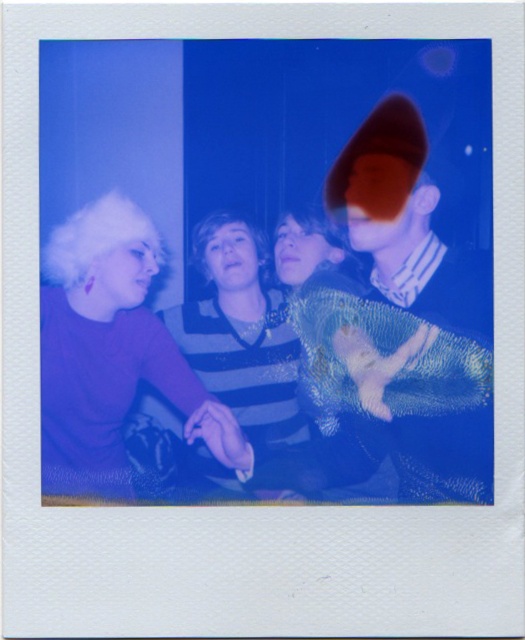
Question: Among these objects, which one is nearest to the camera?

Choices:
 (A) shiny metallic jacket at right
 (B) purple matte shirt at left

Answer: (B)

Question: Is shiny metallic jacket at right smaller than purple shiny sweater at center?

Choices:
 (A) yes
 (B) no

Answer: (B)

Question: Does shiny metallic jacket at right appear on the left side of purple matte shirt at left?

Choices:
 (A) yes
 (B) no

Answer: (B)

Question: Among these objects, which one is farthest from the camera?

Choices:
 (A) shiny metallic jacket at right
 (B) purple shiny sweater at center

Answer: (B)

Question: Is shiny metallic jacket at right to the left of purple matte shirt at left from the viewer's perspective?

Choices:
 (A) no
 (B) yes

Answer: (A)

Question: Which object is farther from the camera taking this photo?

Choices:
 (A) purple matte shirt at left
 (B) shiny metallic jacket at right

Answer: (B)